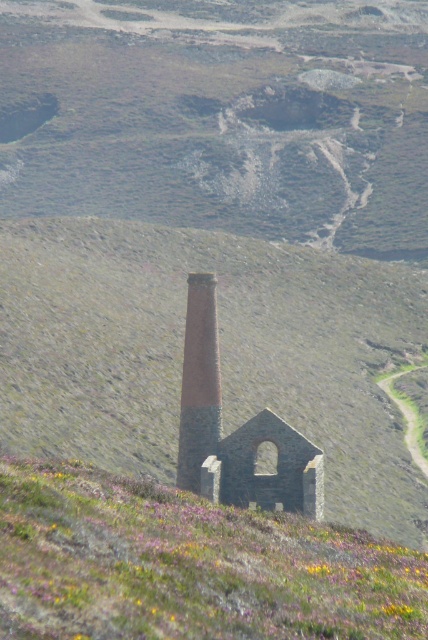
Is stone chimney at center taller than rustic stone tower at center?

Correct, stone chimney at center is much taller as rustic stone tower at center.

Is point (59, 221) positioned after point (237, 474)?

Yes, it is.

Locate an element on the screen. This screenshot has width=428, height=640. stone chimney at center is located at coordinates (219, 353).

Between green grassy at center and red brick chimney at center, which one is positioned lower?

green grassy at center

Can you confirm if green grassy at center is positioned to the left of red brick chimney at center?

No, green grassy at center is not to the left of red brick chimney at center.

Find the location of a particular element. This screenshot has width=428, height=640. green grassy at center is located at coordinates (187, 564).

Does rustic stone tower at center have a lesser width compared to red brick chimney at center?

In fact, rustic stone tower at center might be wider than red brick chimney at center.

Does rustic stone tower at center come behind red brick chimney at center?

That is False.

Which is behind, point (291, 486) or point (195, 412)?

The point (195, 412) is behind.

Find the location of a particular element. rustic stone tower at center is located at coordinates (235, 429).